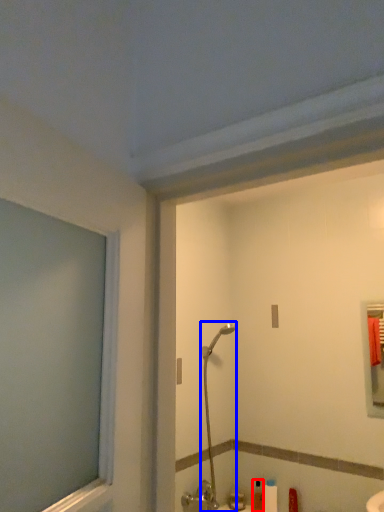
Question: Which object is further to the camera taking this photo, toiletry (highlighted by a red box) or shower (highlighted by a blue box)?

Choices:
 (A) toiletry
 (B) shower

Answer: (A)